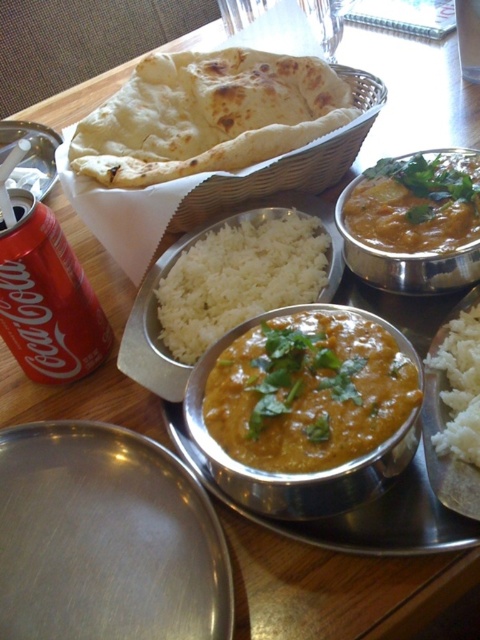
Can you confirm if white matte rice at center is positioned below red matte can at left?

Actually, white matte rice at center is above red matte can at left.

Is point (186, 272) positioned in front of point (66, 374)?

That is False.

Where is `white matte rice at center`? The width and height of the screenshot is (480, 640). white matte rice at center is located at coordinates click(239, 278).

Does white matte rice at center lie in front of white fluffy rice at center?

No.

This screenshot has width=480, height=640. I want to click on white matte rice at center, so click(239, 278).

Where is `white matte rice at center`? white matte rice at center is located at coordinates (239, 278).

Between point (430, 378) and point (466, 10), which one is positioned in front?

Point (430, 378) is in front.

Does point (445, 330) come in front of point (468, 67)?

Yes, it is in front of point (468, 67).

Who is more forward, [428,420] or [463,44]?

Point [428,420] is in front.

In order to click on white fluffy rice at center in this screenshot , I will do `click(441, 428)`.